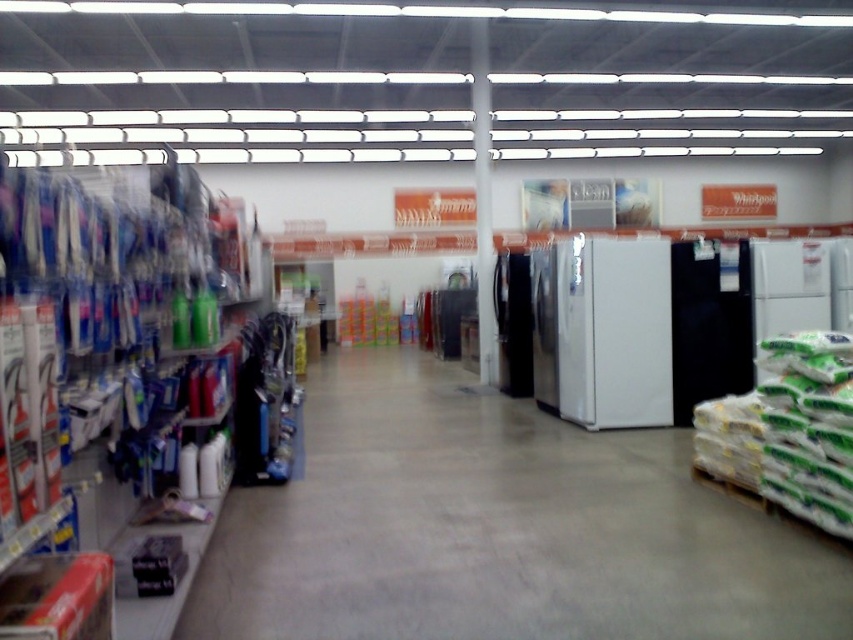
Question: Does white matte refrigerator at center-right have a lesser width compared to satin silver refrigerator at center?

Choices:
 (A) yes
 (B) no

Answer: (B)

Question: Which point is farther from the camera taking this photo?

Choices:
 (A) (544, 364)
 (B) (796, 259)
 (C) (659, 374)

Answer: (A)

Question: In this image, where is white glossy refrigerator at center located relative to white matte refrigerator at center?

Choices:
 (A) left
 (B) right

Answer: (A)

Question: Estimate the real-world distances between objects in this image. Which object is farther from the white plastic bottles at left?

Choices:
 (A) white matte refrigerator at center-right
 (B) white matte refrigerator at center
 (C) black matte refrigerator at right
 (D) white glossy refrigerator at center

Answer: (A)

Question: Can you confirm if satin black refrigerator at center is thinner than satin silver refrigerator at center?

Choices:
 (A) no
 (B) yes

Answer: (A)

Question: Which of the following is the farthest from the observer?

Choices:
 (A) satin black refrigerator at center
 (B) white plastic bottles at left
 (C) white glossy refrigerator at center
 (D) satin silver refrigerator at center

Answer: (A)